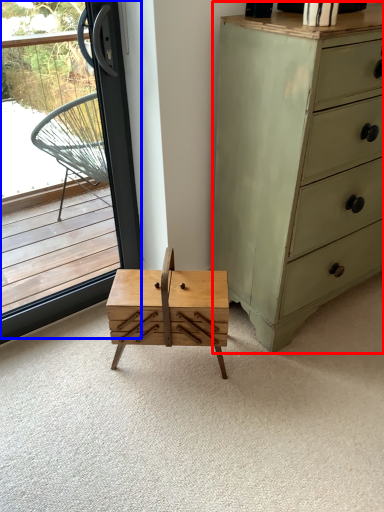
Question: Among these objects, which one is nearest to the camera, chest of drawers (highlighted by a red box) or window (highlighted by a blue box)?

Choices:
 (A) chest of drawers
 (B) window

Answer: (A)